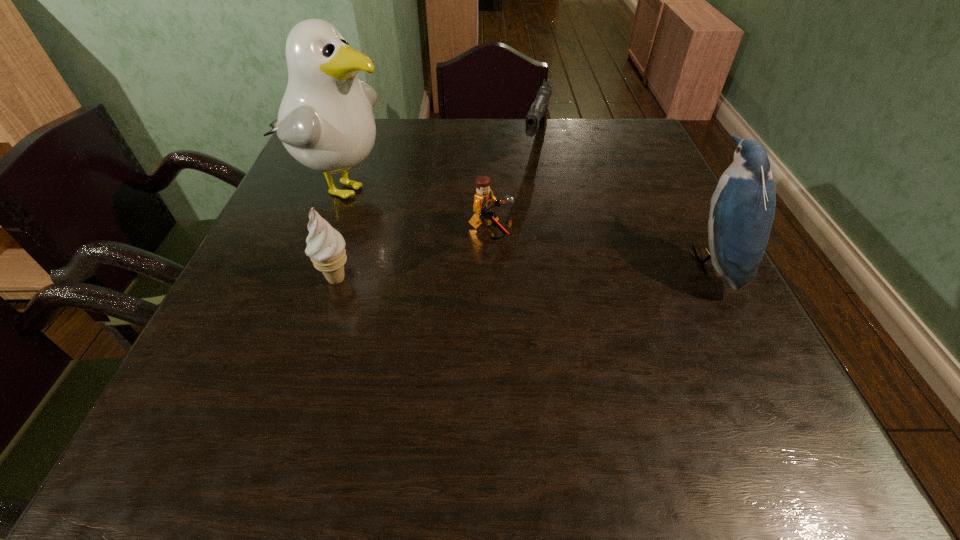
I want to click on object that is the second closest to the tallest object, so click(484, 199).

Locate an element on the screen. The image size is (960, 540). object that stands as the closest to the tallest object is located at coordinates (325, 246).

You are a GUI agent. You are given a task and a screenshot of the screen. Output one action in this format:
    pyautogui.click(x=<x>, y=<y>)
    Task: Click on the free space in the image that satisfies the following two spatial constraints: 1. on the back side of the second object from right to left; 2. on the right side of the third object from right to left
    Image resolution: width=960 pixels, height=540 pixels.
    Given the screenshot: What is the action you would take?
    pyautogui.click(x=488, y=143)